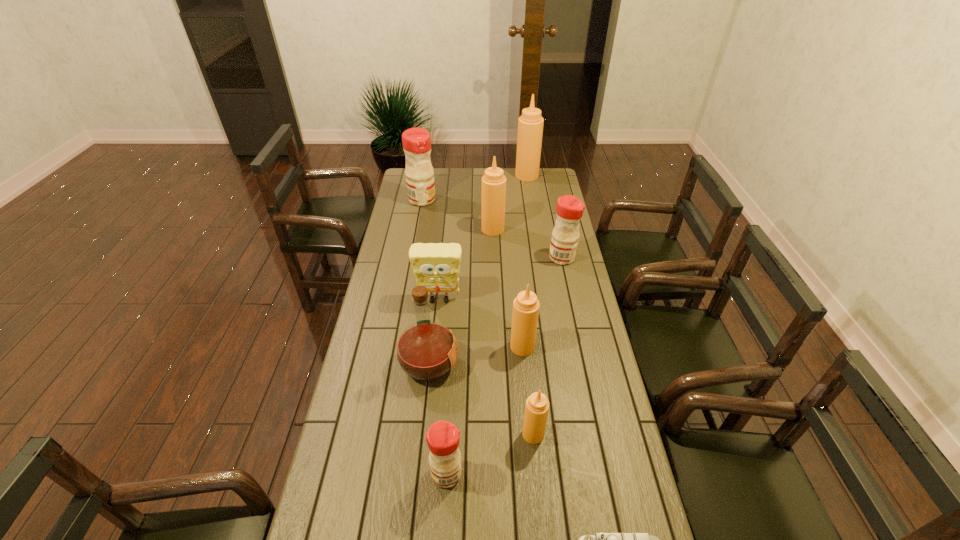
This screenshot has height=540, width=960. I want to click on the second biggest red condiment, so click(x=564, y=242).

I want to click on sponge, so click(436, 266).

Identify the location of the smallest tan condiment. (537, 405).

Locate an element on the screen. The width and height of the screenshot is (960, 540). the eighth farthest object is located at coordinates (537, 405).

Where is `the smallest red condiment`? the smallest red condiment is located at coordinates (443, 437).

Where is `the nearest red condiment`? Image resolution: width=960 pixels, height=540 pixels. the nearest red condiment is located at coordinates (443, 437).

At what (x,y) coordinates should I click in order to perform the action: click on vacant space positioned 0.250m on the front of the tallest condiment. Please return your answer as a coordinate pair (x, y). The width and height of the screenshot is (960, 540). Looking at the image, I should click on (532, 207).

The image size is (960, 540). Find the location of `free space located 0.100m on the left of the third farthest object`. free space located 0.100m on the left of the third farthest object is located at coordinates (460, 230).

Image resolution: width=960 pixels, height=540 pixels. Identify the location of vacant area situated 0.240m on the front of the leftmost red condiment. (416, 235).

Locate an element on the screen. vacant space located 0.330m on the front label of the liquor is located at coordinates (556, 364).